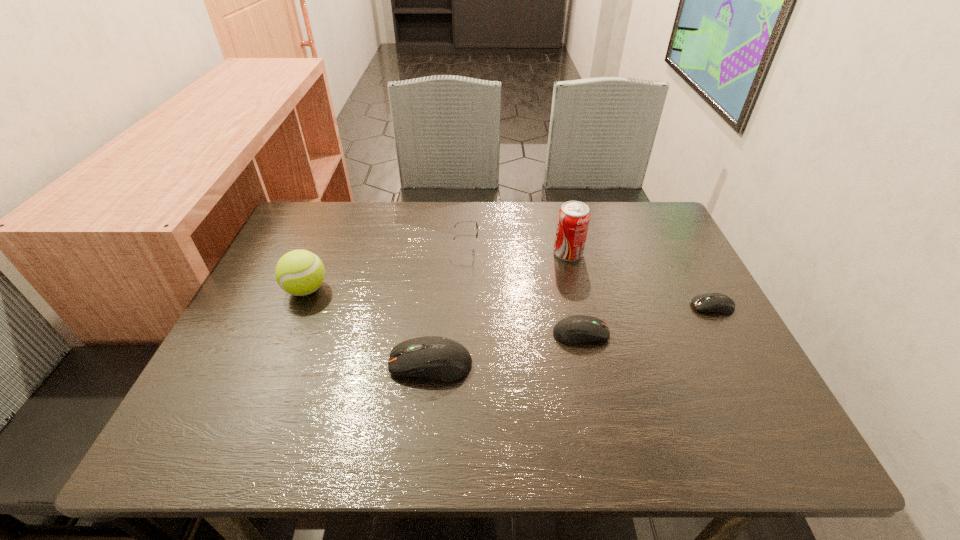
Find the location of a particular element. The image size is (960, 540). vacant space situated on the button of the nearest computer equipment is located at coordinates (338, 363).

Where is `vacant space situated on the button of the nearest computer equipment`? The width and height of the screenshot is (960, 540). vacant space situated on the button of the nearest computer equipment is located at coordinates (324, 363).

At what (x,y) coordinates should I click in order to perform the action: click on free space located on the button of the nearest computer equipment. Please return your answer as a coordinate pair (x, y). Image resolution: width=960 pixels, height=540 pixels. Looking at the image, I should click on (338, 363).

You are a GUI agent. You are given a task and a screenshot of the screen. Output one action in this format:
    pyautogui.click(x=<x>, y=<y>)
    Task: Click on the vacant region located 0.180m on the button of the fifth tallest object
    
    Given the screenshot: What is the action you would take?
    pyautogui.click(x=687, y=333)

At what (x,y) coordinates should I click in order to perform the action: click on free space located 0.190m on the button of the rightmost computer equipment. Please return your answer as a coordinate pair (x, y). The width and height of the screenshot is (960, 540). Looking at the image, I should click on (613, 307).

Identify the location of vacant region located 0.290m on the button of the rightmost computer equipment. (571, 307).

This screenshot has width=960, height=540. I want to click on vacant space located 0.190m on the button of the rightmost computer equipment, so click(613, 307).

Identify the location of vacant space situated 0.050m in front of the lenses of the third tallest object. (497, 245).

This screenshot has width=960, height=540. What are the coordinates of `vacant space positioned 0.250m on the left of the tallest object` in the screenshot? It's located at pyautogui.click(x=463, y=253).

Where is `free location located 0.170m on the back of the leftmost object`? free location located 0.170m on the back of the leftmost object is located at coordinates (329, 235).